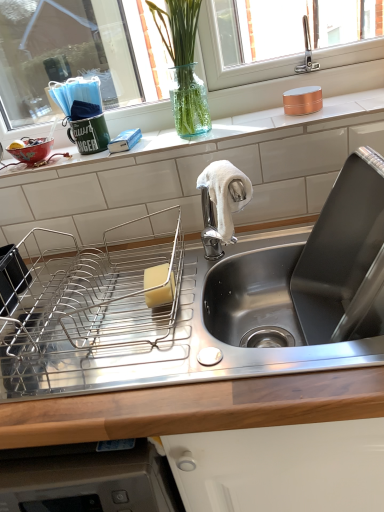
Find the location of a particular element. Image resolution: width=384 pixels, height=512 pixels. free space in front of copper metallic canister at upper right, arranged as the second appliance when viewed from the left is located at coordinates (317, 117).